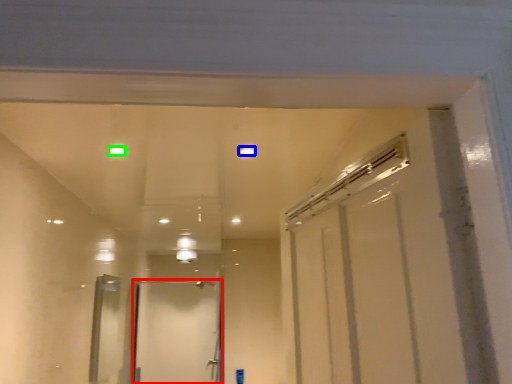
Question: Which object is positioned closest to door (highlighted by a red box)? Select from light (highlighted by a blue box) and light (highlighted by a green box).

Choices:
 (A) light
 (B) light

Answer: (B)